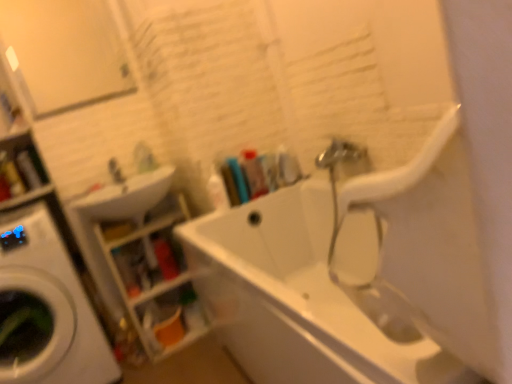
Question: Considering the relative positions of white glossy washing machine at left and white glossy bathtub at center in the image provided, is white glossy washing machine at left in front of white glossy bathtub at center?

Choices:
 (A) no
 (B) yes

Answer: (A)

Question: From the image's perspective, would you say white glossy washing machine at left is shown under white glossy bathtub at center?

Choices:
 (A) yes
 (B) no

Answer: (A)

Question: Is white glossy washing machine at left far away from white glossy bathtub at center?

Choices:
 (A) yes
 (B) no

Answer: (B)

Question: Is white glossy bathtub at center at the back of white glossy washing machine at left?

Choices:
 (A) yes
 (B) no

Answer: (B)

Question: Could you tell me if white glossy washing machine at left is facing white glossy bathtub at center?

Choices:
 (A) no
 (B) yes

Answer: (A)

Question: From the image's perspective, is translucent plastic toothbrushes at upper center, which appears as the second toiletry when viewed from the right, above or below translucent plastic bottle at center, the 1th toiletry positioned from the right?

Choices:
 (A) below
 (B) above

Answer: (A)

Question: Is point pyautogui.click(x=241, y=185) positioned closer to the camera than point pyautogui.click(x=259, y=175)?

Choices:
 (A) farther
 (B) closer

Answer: (B)

Question: Is translucent plastic toothbrushes at upper center, which appears as the 3th toiletry when viewed from the left, taller or shorter than translucent plastic bottle at center, which is the fourth toiletry from left to right?

Choices:
 (A) tall
 (B) short

Answer: (A)

Question: From a real-world perspective, relative to translucent plastic bottle at center, which is the fourth toiletry from left to right, is translucent plastic toothbrushes at upper center, which appears as the second toiletry when viewed from the right, vertically above or below?

Choices:
 (A) below
 (B) above

Answer: (A)

Question: Is point (121, 175) positioned closer to the camera than point (34, 175)?

Choices:
 (A) farther
 (B) closer

Answer: (A)

Question: Is satin nickel faucet at upper left wider or thinner than translucent plastic bottle at upper left, which is the 4th toiletry from right to left?

Choices:
 (A) wide
 (B) thin

Answer: (A)

Question: Based on their sizes in the image, would you say satin nickel faucet at upper left is bigger or smaller than translucent plastic bottle at upper left, which is the 4th toiletry from right to left?

Choices:
 (A) small
 (B) big

Answer: (B)

Question: In terms of height, does satin nickel faucet at upper left look taller or shorter compared to translucent plastic bottle at upper left, acting as the first toiletry starting from the left?

Choices:
 (A) tall
 (B) short

Answer: (B)

Question: Is translucent plastic shelves at lower left bigger or smaller than white glossy sink at upper left?

Choices:
 (A) small
 (B) big

Answer: (B)

Question: Does point pos(169,289) appear closer or farther from the camera than point pos(101,195)?

Choices:
 (A) closer
 (B) farther

Answer: (B)